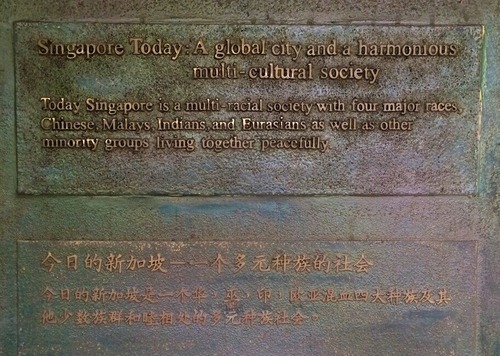
Where is `stains`? stains is located at coordinates pyautogui.click(x=399, y=16).